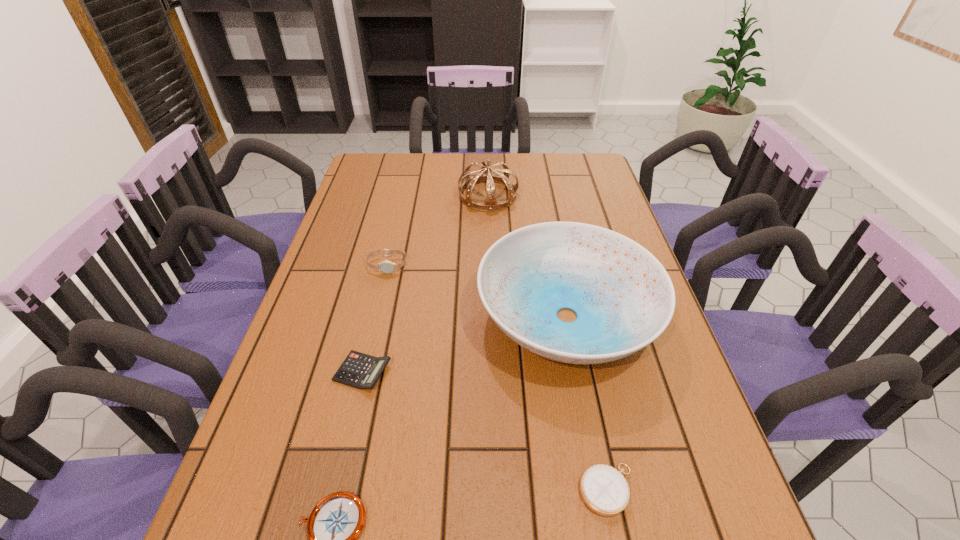
Find the location of a particular element. The height and width of the screenshot is (540, 960). empty space that is in between the farthest object and the watch is located at coordinates (438, 230).

Find the location of a particular element. vacant space in between the farthest object and the calculator is located at coordinates (425, 284).

At what (x,y) coordinates should I click in order to perform the action: click on blank region between the watch and the farthest object. Please return your answer as a coordinate pair (x, y). Looking at the image, I should click on (438, 230).

You are a GUI agent. You are given a task and a screenshot of the screen. Output one action in this format:
    pyautogui.click(x=<x>, y=<y>)
    Task: Click on the free space between the right compass and the watch
    The width and height of the screenshot is (960, 540).
    Given the screenshot: What is the action you would take?
    pyautogui.click(x=497, y=377)

This screenshot has height=540, width=960. What are the coordinates of `blank region between the right compass and the watch` in the screenshot? It's located at (497, 377).

Where is `object that stands as the fifth closest to the right compass`? The image size is (960, 540). object that stands as the fifth closest to the right compass is located at coordinates (485, 174).

Select which object is the third closest to the dish. Please provide its 2D coordinates. Your answer should be formatted as a tuple, i.e. [(x, y)], where the tuple contains the x and y coordinates of a point satisfying the conditions above.

[(387, 267)]

Where is `free spot that satisfies the following two spatial constraints: 1. on the face of the right compass; 2. on the right side of the watch`? free spot that satisfies the following two spatial constraints: 1. on the face of the right compass; 2. on the right side of the watch is located at coordinates (335, 489).

Find the location of a particular element. The width and height of the screenshot is (960, 540). blank area in the image that satisfies the following two spatial constraints: 1. on the face of the watch; 2. on the left side of the dish is located at coordinates (375, 316).

The height and width of the screenshot is (540, 960). I want to click on free space that satisfies the following two spatial constraints: 1. on the face of the calculator; 2. on the right side of the watch, so click(363, 372).